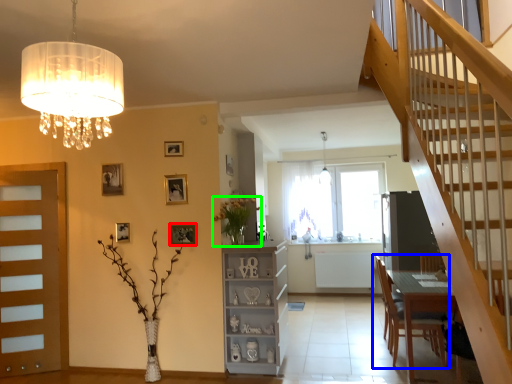
Question: Which is nearer to the picture frame (highlighted by a red box)? chair (highlighted by a blue box) or floral arrangement (highlighted by a green box).

Choices:
 (A) chair
 (B) floral arrangement

Answer: (B)